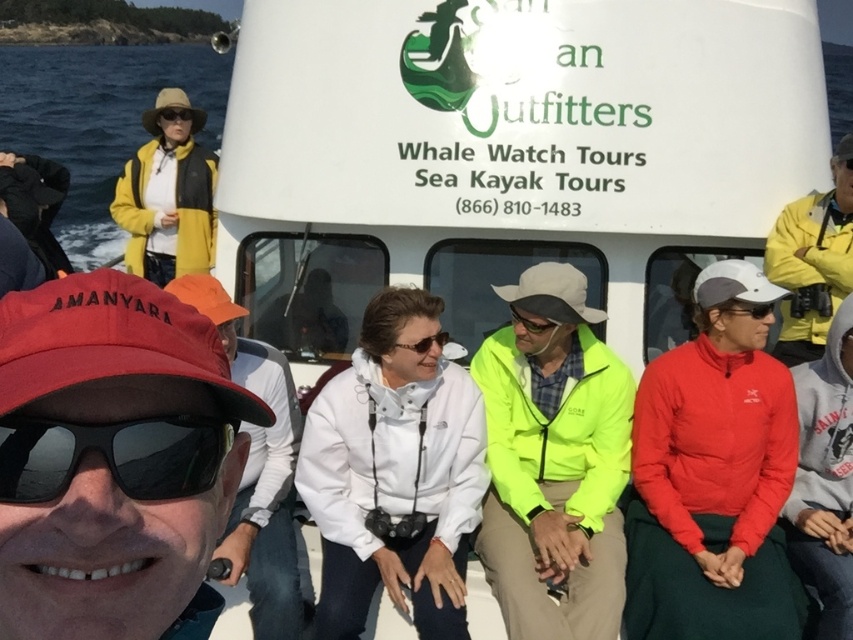
Question: Estimate the real-world distances between objects in this image. Which object is closer to the yellow matte jacket at upper left?

Choices:
 (A) black matte sunglasses at center
 (B) neon yellow jacket at center
 (C) black matte sunglasses at lower left

Answer: (B)

Question: Which is farther from the red matte cap at lower left?

Choices:
 (A) yellow matte jacket at upper right
 (B) matte black goggles at center
 (C) yellow matte jacket at upper left
 (D) blue water at upper left

Answer: (D)

Question: Can you confirm if neon yellow jacket at center is positioned to the right of yellow matte jacket at upper right?

Choices:
 (A) no
 (B) yes

Answer: (A)

Question: Does yellow matte jacket at upper left appear over matte yellow goggles at upper left?

Choices:
 (A) no
 (B) yes

Answer: (B)

Question: Does yellow matte jacket at upper left appear on the right side of yellow matte jacket at upper right?

Choices:
 (A) yes
 (B) no

Answer: (B)

Question: Based on their relative distances, which object is farther from the black matte sunglasses at center?

Choices:
 (A) yellow matte jacket at upper left
 (B) red matte cap at lower left

Answer: (A)